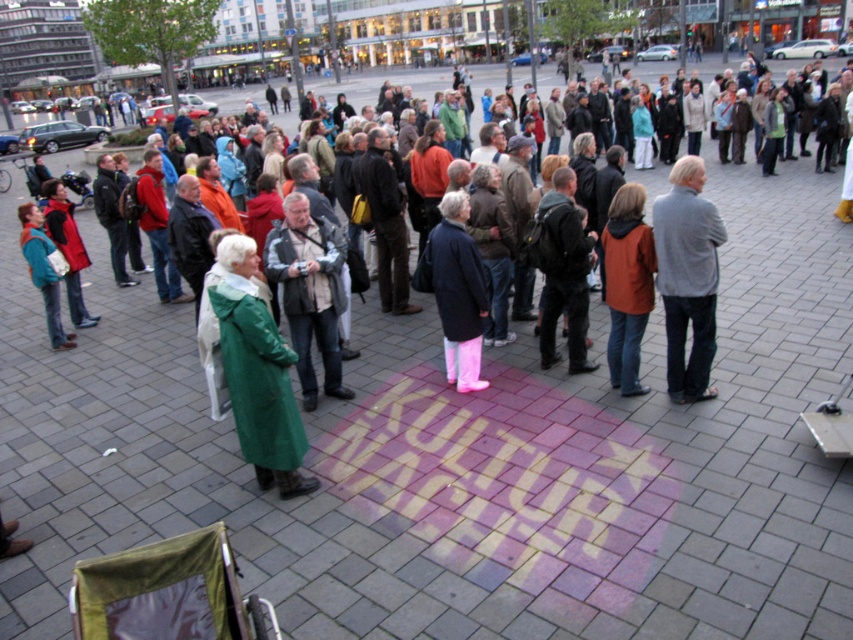
Who is positioned more to the left, green fabric coat at center or dark gray backpack at center?

Positioned to the left is green fabric coat at center.

Does green fabric coat at center appear over dark gray backpack at center?

No.

Does point (283, 257) come farther from viewer compared to point (556, 289)?

No, (283, 257) is closer to viewer.

Identify the location of green fabric coat at center. (309, 292).

Does gray wool sweater at right have a smaller size compared to matte black jacket at center?

No.

Who is lower down, gray wool sweater at right or matte black jacket at center?

matte black jacket at center is lower down.

You are a GUI agent. You are given a task and a screenshot of the screen. Output one action in this format:
    pyautogui.click(x=<x>, y=<y>)
    Task: Click on the gray wool sweater at right
    
    Given the screenshot: What is the action you would take?
    pyautogui.click(x=688, y=276)

Is point (292, 484) behind point (706, 396)?

No, (292, 484) is in front of (706, 396).

Does green matte coat at center appear under gray wool sweater at right?

Indeed, green matte coat at center is positioned under gray wool sweater at right.

Who is more distant from viewer, (308, 481) or (670, 298)?

Positioned behind is point (670, 298).

Identify the location of green matte coat at center. (256, 369).